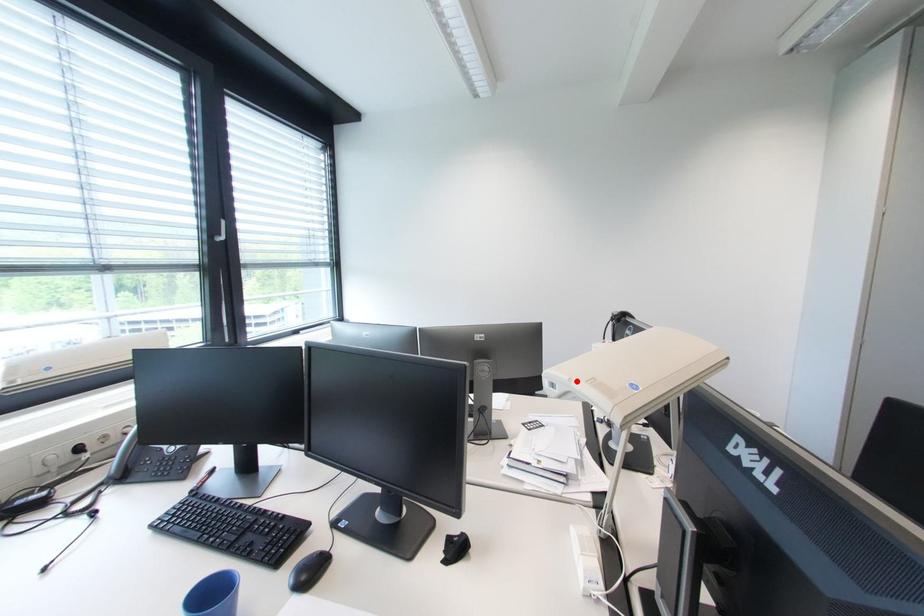
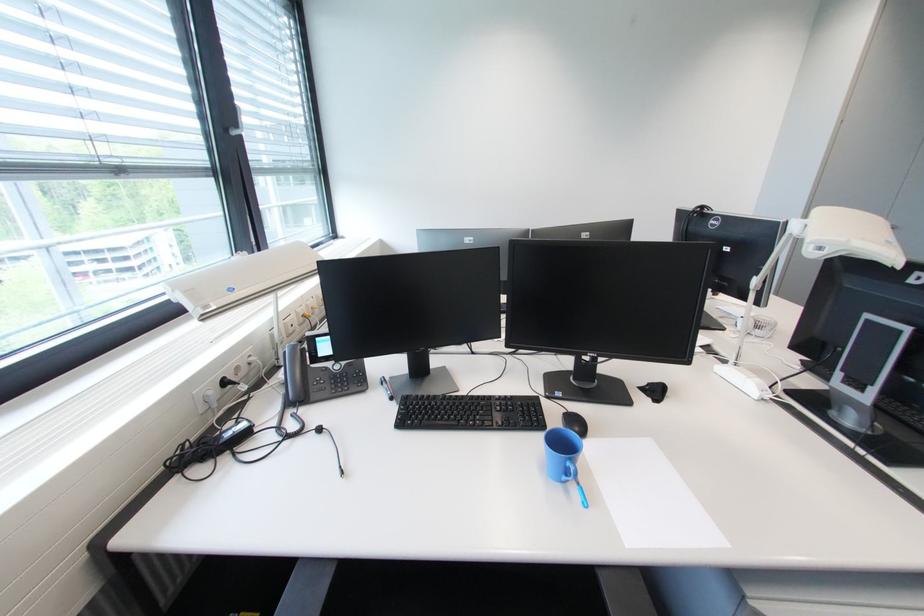
Locate, in the second image, the point that corresponds to the highlighted location in the first image.

(856, 243)